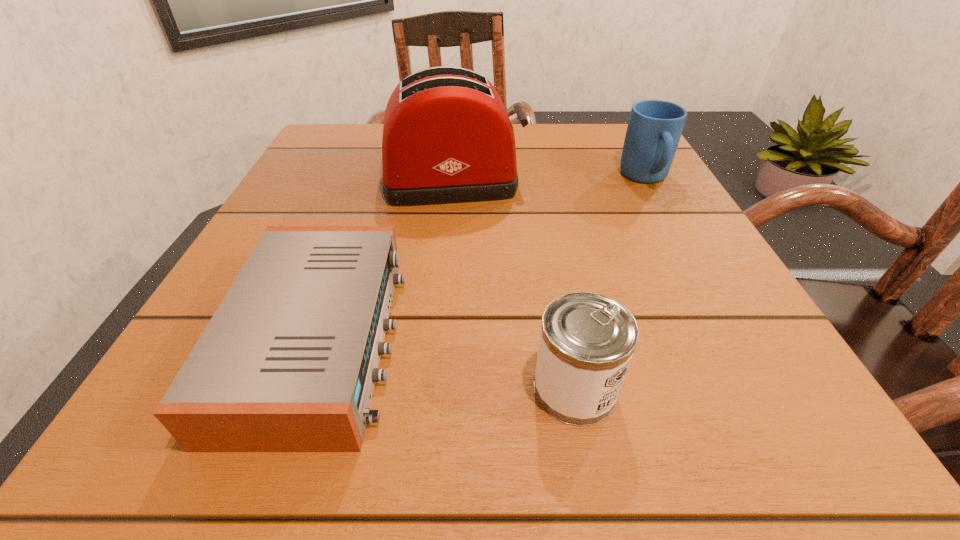
The image size is (960, 540). In the image, there is a desktop. Find the location of `vacant space at the near right corner`. vacant space at the near right corner is located at coordinates (751, 416).

The height and width of the screenshot is (540, 960). What are the coordinates of `vacant space in between the rightmost object and the radio receiver` in the screenshot? It's located at (483, 260).

You are a GUI agent. You are given a task and a screenshot of the screen. Output one action in this format:
    pyautogui.click(x=<x>, y=<y>)
    Task: Click on the free spot between the second shortest object and the tallest object
    
    Given the screenshot: What is the action you would take?
    pyautogui.click(x=514, y=285)

I want to click on empty space that is in between the can and the tallest object, so click(514, 285).

The image size is (960, 540). I want to click on vacant region between the tallest object and the mug, so click(549, 180).

Locate an element on the screen. The height and width of the screenshot is (540, 960). free space between the second shortest object and the mug is located at coordinates (610, 284).

This screenshot has width=960, height=540. Identify the location of free space between the mug and the tallest object. (549, 180).

Where is `free area in between the rightmost object and the shortest object`? Image resolution: width=960 pixels, height=540 pixels. free area in between the rightmost object and the shortest object is located at coordinates pyautogui.click(x=483, y=260).

Image resolution: width=960 pixels, height=540 pixels. In order to click on object that is the third closest to the toaster in this screenshot , I will do `click(587, 340)`.

This screenshot has width=960, height=540. I want to click on object that is the closest to the third tallest object, so click(288, 362).